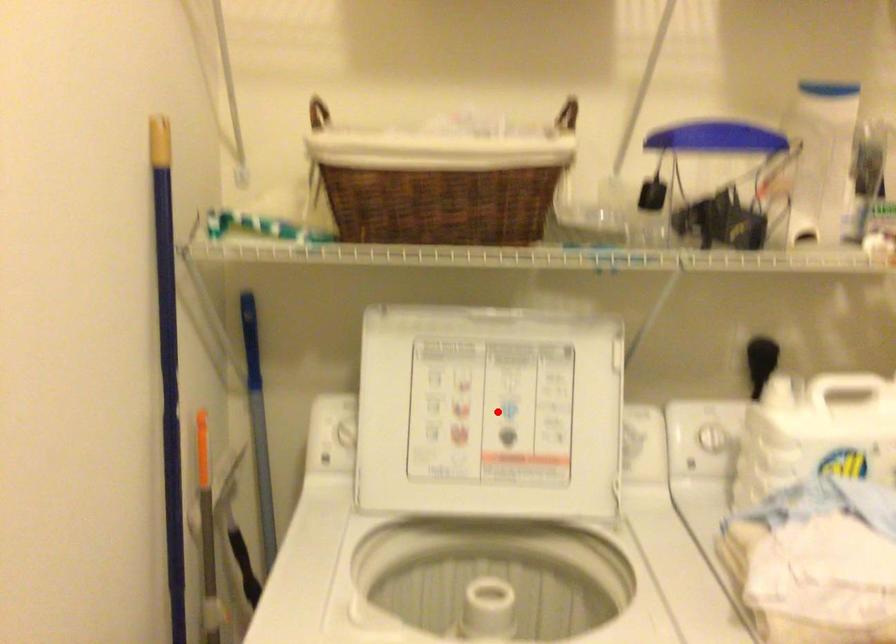
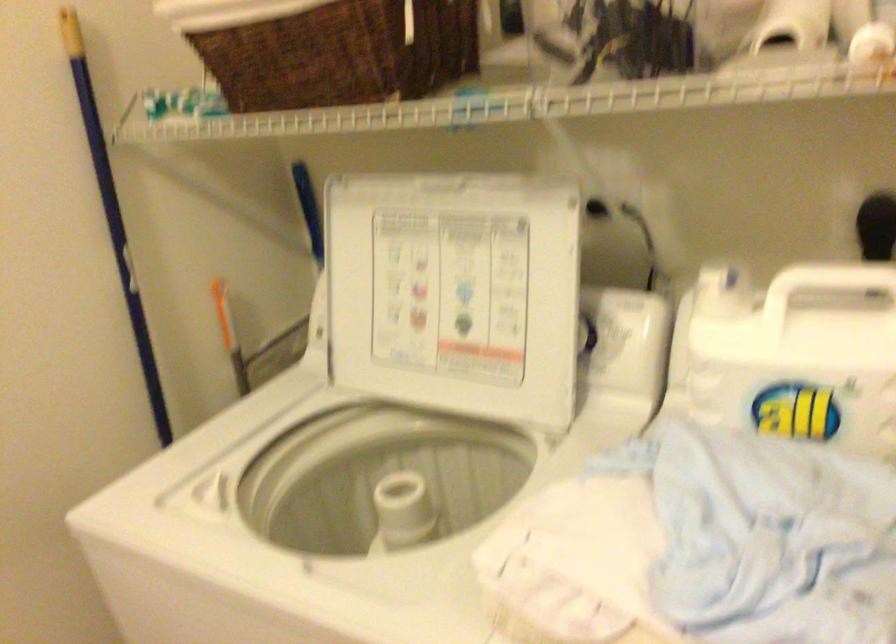
Question: I am providing you with two images of the same scene from different viewpoints. Given a red point in image1, look at the same physical point in image2. Is it:

Choices:
 (A) Closer to the viewpoint
 (B) Farther from the viewpoint

Answer: (A)